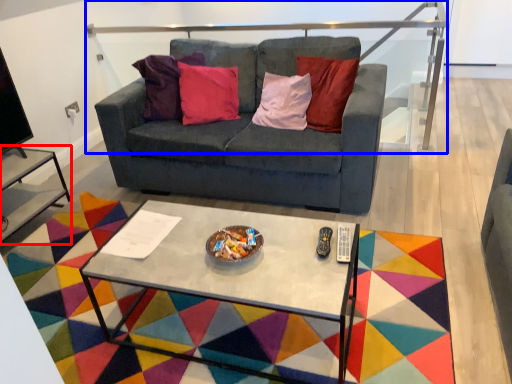
Question: Which point is further to the camera, side table (highlighted by a red box) or balustrade (highlighted by a blue box)?

Choices:
 (A) side table
 (B) balustrade

Answer: (B)